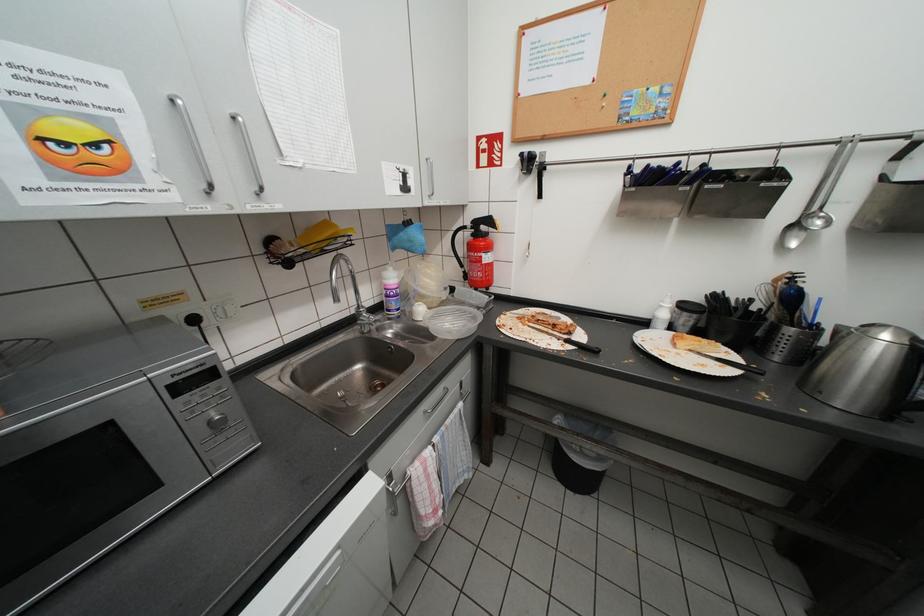
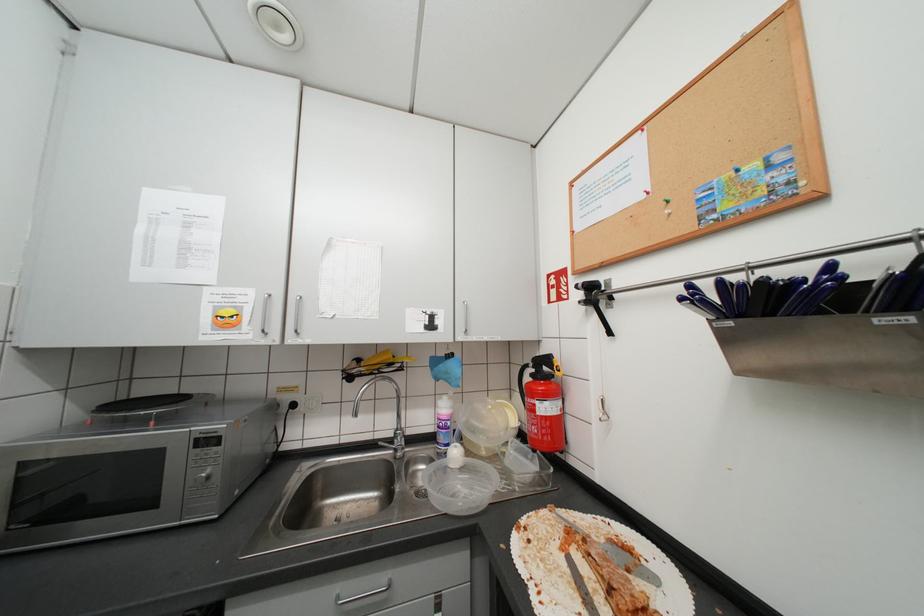
In the scene shown: First-person continuous shooting, in which direction is the camera rotating?

The camera's rotation is toward left-up.